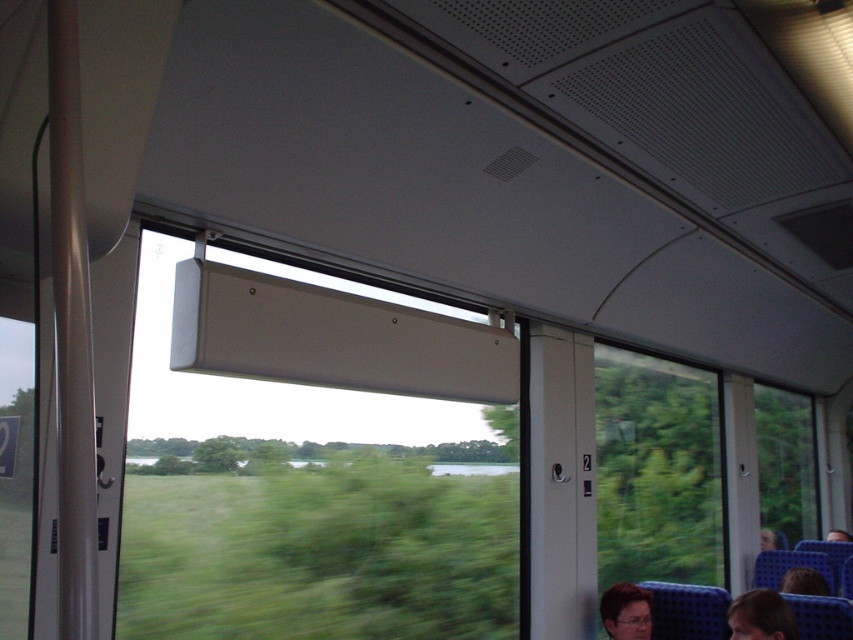
Question: Can you confirm if white matte window at center is positioned to the left of smooth brown hair at lower right?

Choices:
 (A) yes
 (B) no

Answer: (A)

Question: Which object appears closest to the camera in this image?

Choices:
 (A) smooth brown hair at lower right
 (B) dark brown hair at lower right
 (C) blue fabric headrest at lower right
 (D) green matte window at right

Answer: (A)

Question: Does green matte window at right come in front of dark brown hair at lower right?

Choices:
 (A) no
 (B) yes

Answer: (B)

Question: Does blonde hair at lower right appear on the left side of dark brown hair at lower right?

Choices:
 (A) yes
 (B) no

Answer: (A)

Question: Which of the following is the closest to the observer?

Choices:
 (A) blue fabric headrest at lower right
 (B) green matte window at right

Answer: (B)

Question: Which object appears farthest from the camera in this image?

Choices:
 (A) green matte window at right
 (B) white matte window at center
 (C) blue fabric headrest at lower right
 (D) blonde hair at lower right

Answer: (C)